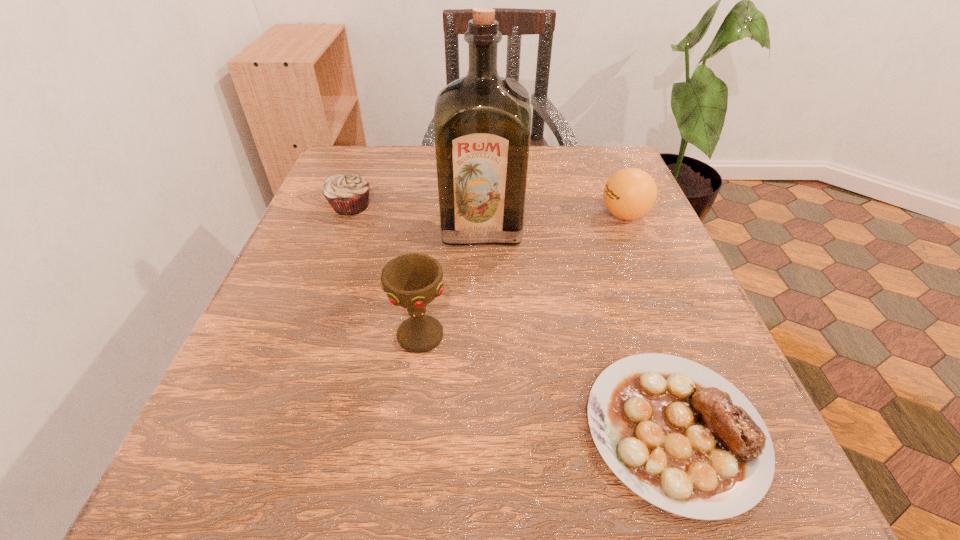
Where is `unoccupied position between the second tallest object and the shortest object`? unoccupied position between the second tallest object and the shortest object is located at coordinates (547, 382).

I want to click on vacant space that's between the tallest object and the fourth tallest object, so click(x=417, y=216).

The image size is (960, 540). I want to click on object that is the fourth closest to the tallest object, so click(x=679, y=435).

The width and height of the screenshot is (960, 540). Identify the location of the third closest object relative to the leftmost object. (630, 193).

This screenshot has width=960, height=540. What are the coordinates of `vacant area that satisfies the following two spatial constraints: 1. on the side with brand of the ping-pong ball; 2. on the label of the liquor` in the screenshot? It's located at (629, 226).